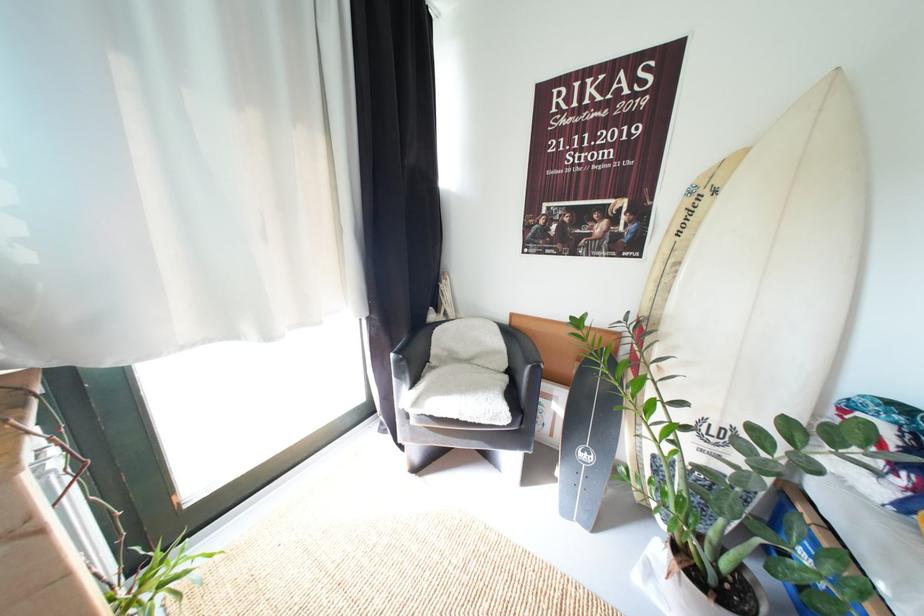
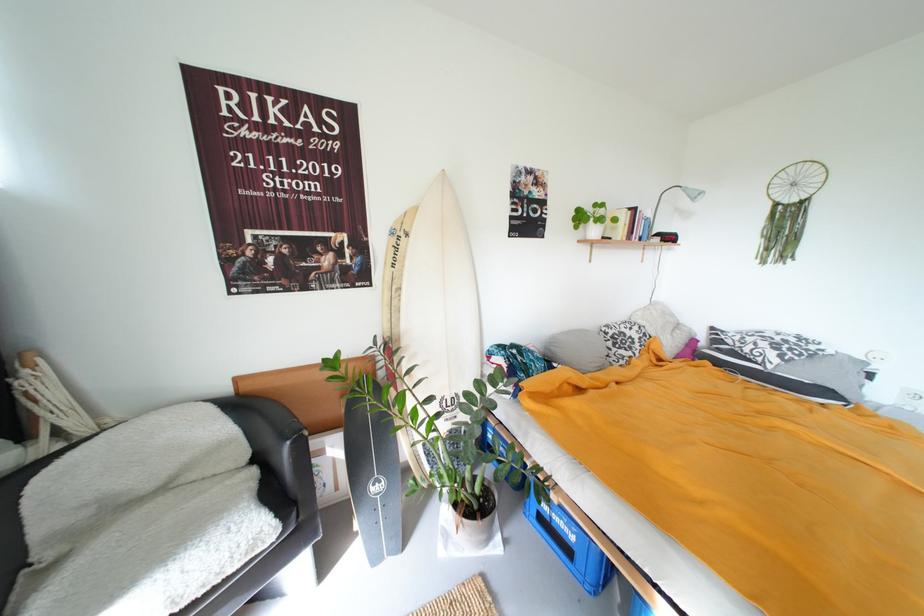
Where in the second image is the point corresponding to pixel 517 326 from the first image?

(246, 395)